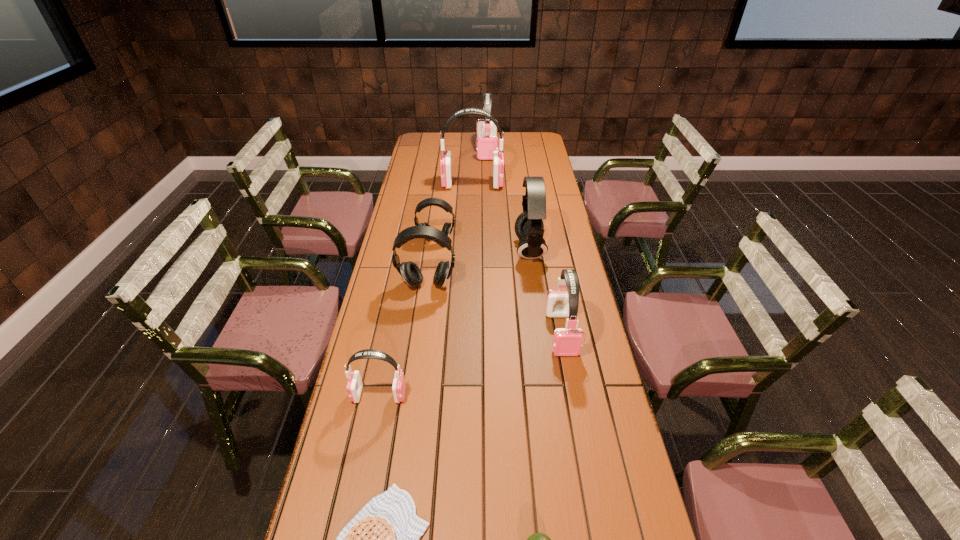
Identify the location of empty space between the smallest pink earphone and the rightmost pink earphone. This screenshot has width=960, height=540. (470, 364).

Locate an element on the screen. The image size is (960, 540). free space between the biggest black earphone and the rightmost pink earphone is located at coordinates pos(545,292).

Identify the location of object identified as the second closest to the biggest pink earphone. The height and width of the screenshot is (540, 960). (529, 227).

The image size is (960, 540). Identify the location of object that is the third closest to the third nearest object. pos(567,341).

Where is `earphone that is the fourth closest one to the rightmost black earphone`? earphone that is the fourth closest one to the rightmost black earphone is located at coordinates (446, 159).

Locate which earphone ranks fifth in proximity to the second farthest earphone. Please provide its 2D coordinates. Your answer should be formatted as a tuple, i.e. [(x, y)], where the tuple contains the x and y coordinates of a point satisfying the conditions above.

[(567, 341)]

Locate an element on the screen. The height and width of the screenshot is (540, 960). the fourth closest pink earphone to the second biggest black earphone is located at coordinates (487, 141).

Identify which pink earphone is the closest to the nearest black earphone. Please provide its 2D coordinates. Your answer should be formatted as a tuple, i.e. [(x, y)], where the tuple contains the x and y coordinates of a point satisfying the conditions above.

[(567, 341)]

Choose which black earphone is the nearest neighbor to the nearest black earphone. Please provide its 2D coordinates. Your answer should be formatted as a tuple, i.e. [(x, y)], where the tuple contains the x and y coordinates of a point satisfying the conditions above.

[(447, 229)]

Find the location of a particular element. black earphone that is the closest to the third smallest pink earphone is located at coordinates (529, 227).